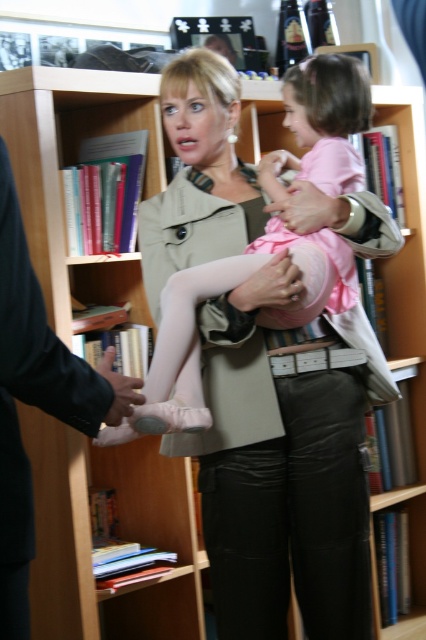
From the picture: Who is higher up, matte beige hand at center or black leather hand at lower left?

Positioned higher is matte beige hand at center.

Is matte beige hand at center bigger than black leather hand at lower left?

No.

This screenshot has height=640, width=426. What are the coordinates of `matte beige hand at center` in the screenshot? It's located at (270, 285).

In the scene shown: Can you confirm if pink satin dress at center is positioned above matte beige hand at center?

Correct, pink satin dress at center is located above matte beige hand at center.

Between point (186, 154) and point (279, 296), which one is positioned in front?

Point (279, 296) is more forward.

Image resolution: width=426 pixels, height=640 pixels. Find the location of `pink satin dress at center`. pink satin dress at center is located at coordinates (227, 291).

Is dark gray suit at left further to camera compared to black leather hand at lower left?

No, it is not.

Is point (104, 384) positioned behind point (109, 372)?

No, (104, 384) is in front of (109, 372).

This screenshot has width=426, height=640. I want to click on dark gray suit at left, so click(x=36, y=400).